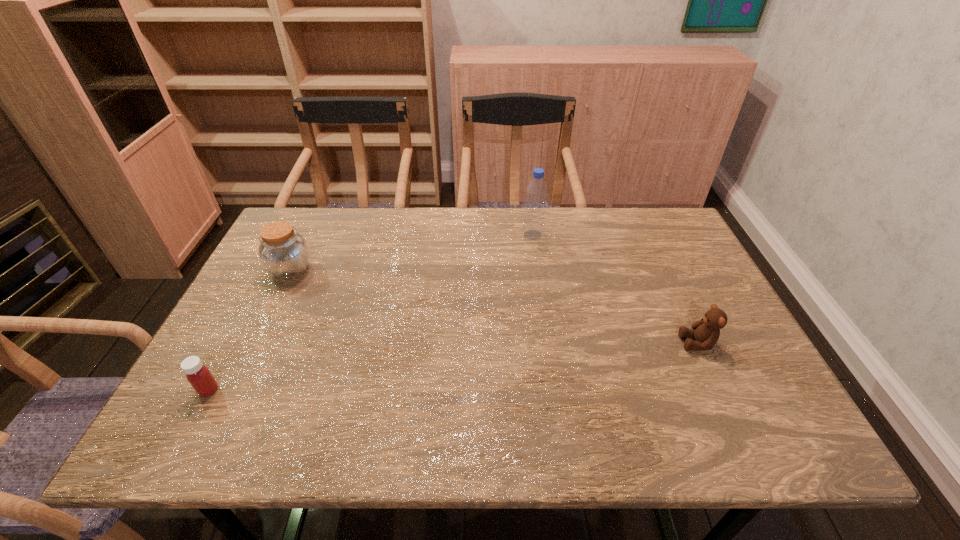
Identify the location of vacant space that is in between the medicine and the rightmost object. This screenshot has width=960, height=540. (453, 367).

Identify the location of vacant space that is in between the nearest object and the second object from right to left. (371, 312).

What are the coordinates of `the second closest object to the third nearest object` in the screenshot? It's located at (533, 226).

Locate which object ranks third in proximity to the tallest object. Please provide its 2D coordinates. Your answer should be formatted as a tuple, i.e. [(x, y)], where the tuple contains the x and y coordinates of a point satisfying the conditions above.

[(198, 375)]